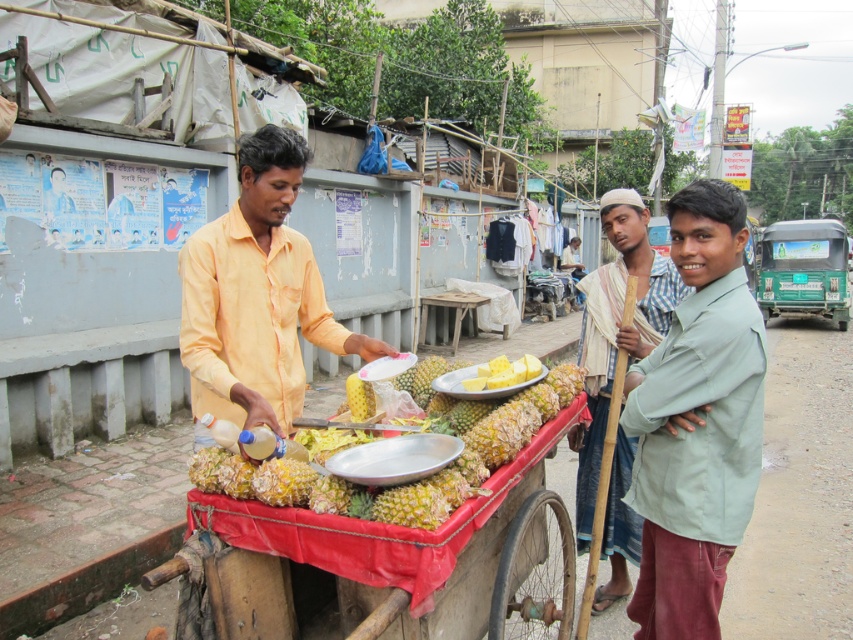
You are standing in front of the pineapple cart and want to know which of the two points, point (614, 468) or point (373, 396), is closer to you. Which one is closer?

Point (373, 396) is closer to you because it is less far from the camera than point (614, 468).